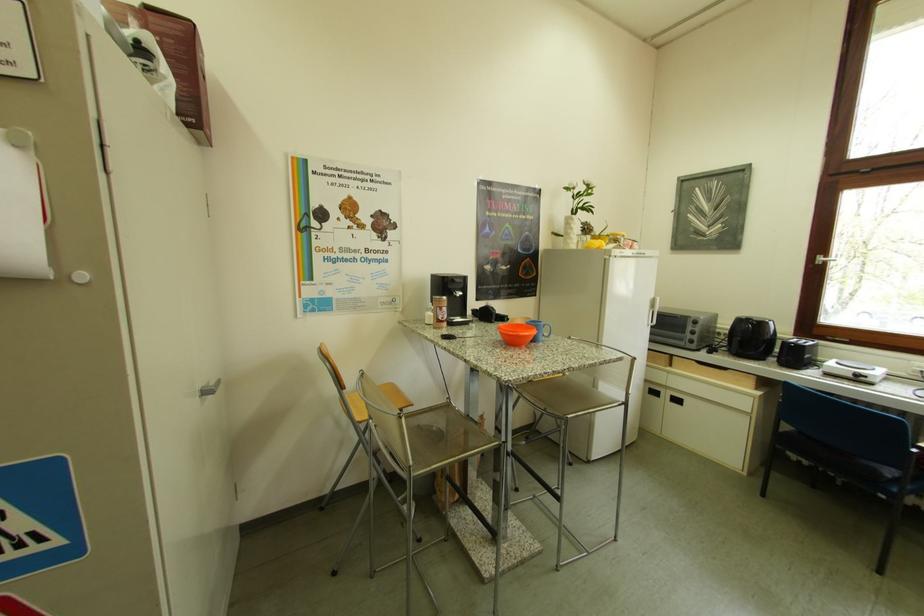
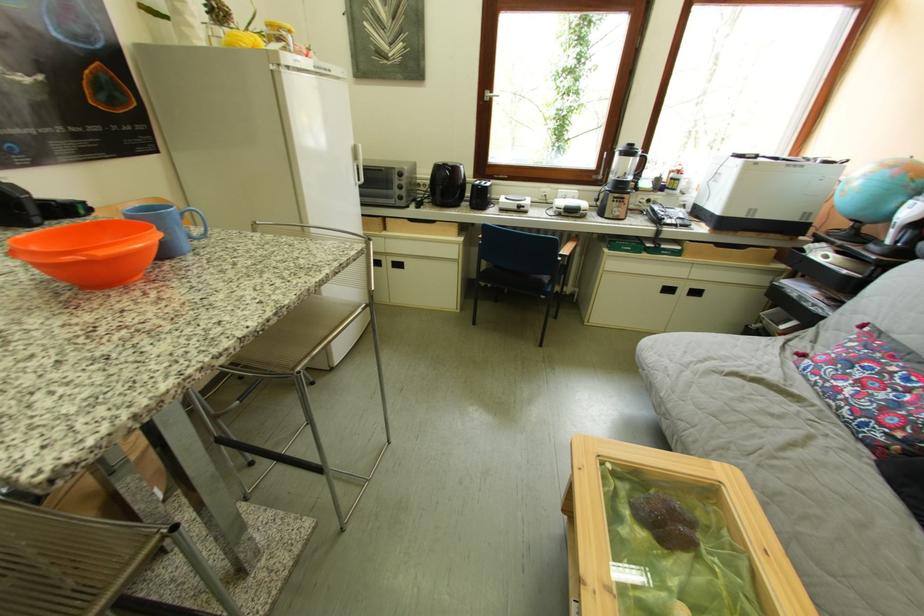
The point at (754,325) is marked in the first image. Where is the corresponding point in the second image?

(451, 171)